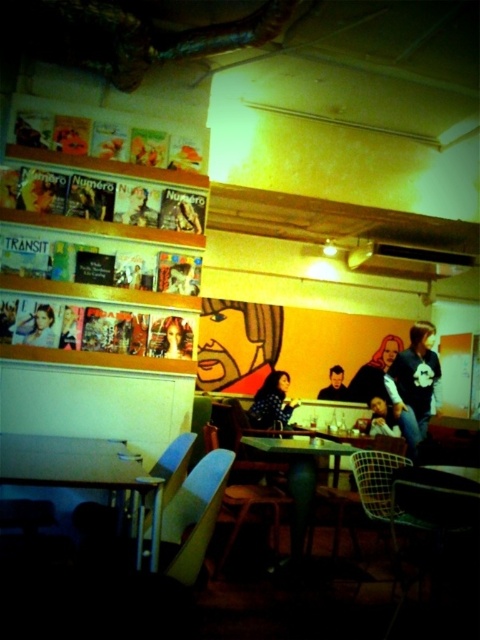
Question: Can you confirm if dark blue jeans at center is positioned below wooden table at center?

Choices:
 (A) no
 (B) yes

Answer: (A)

Question: Can you confirm if wooden table at center is wider than matte black jacket at center?

Choices:
 (A) yes
 (B) no

Answer: (A)

Question: Based on their relative distances, which object is nearer to the metallic silver table at lower left?

Choices:
 (A) matte black portrait at lower left
 (B) matte black jacket at center
 (C) dark blue jeans at center
 (D) polka dot blouse at center

Answer: (A)

Question: In this image, where is metallic silver table at lower left located relative to matte black jacket at center?

Choices:
 (A) below
 (B) above

Answer: (B)

Question: Estimate the real-world distances between objects in this image. Which object is farther from the metallic silver table at lower left?

Choices:
 (A) dark blue jeans at center
 (B) wooden table at center

Answer: (A)

Question: Which is farther from the matte black jacket at center?

Choices:
 (A) dark blue jeans at center
 (B) polka dot blouse at center
 (C) smooth black shirt at center
 (D) wooden table at center

Answer: (D)